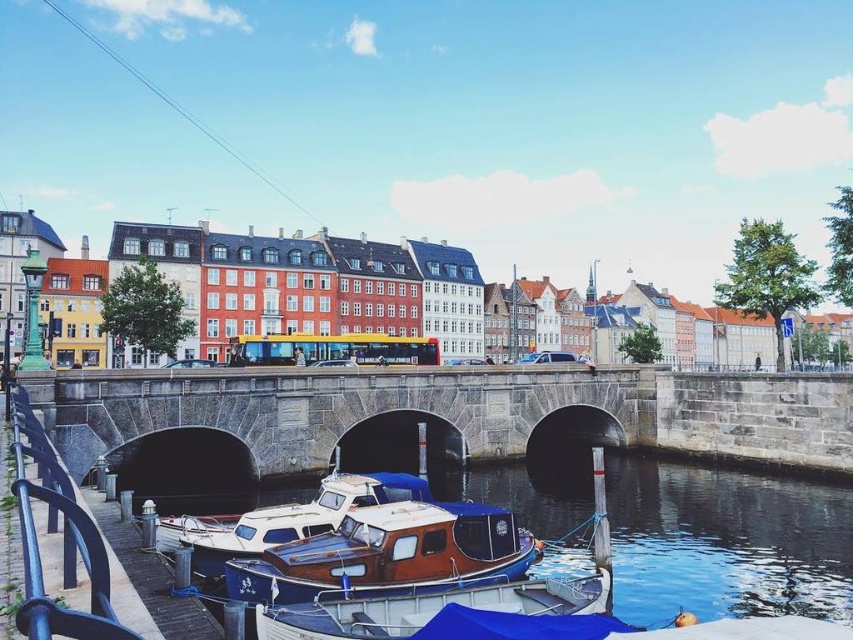
Does wooden boat at center appear under white glossy boat at center?

Yes, wooden boat at center is below white glossy boat at center.

Which is below, wooden boat at center or white glossy boat at center?

wooden boat at center is below.

Who is more forward, [347,637] or [196,572]?

Point [347,637] is more forward.

The image size is (853, 640). I want to click on wooden boat at center, so click(430, 608).

Which is above, wooden polished boat at lower center or white glossy boat at center?

white glossy boat at center is higher up.

Is point (490, 528) in front of point (381, 476)?

Yes.

This screenshot has height=640, width=853. I want to click on wooden polished boat at lower center, so click(x=389, y=554).

Looking at this image, measure the distance between point (195,410) and camera.

Point (195,410) and camera are 69.72 meters apart from each other.

Which is below, gray stone bridge at center or white glossy boat at center?

white glossy boat at center is lower down.

Is point (123, 378) more distant than point (241, 531)?

That is True.

Identify the location of gray stone bridge at center. (328, 422).